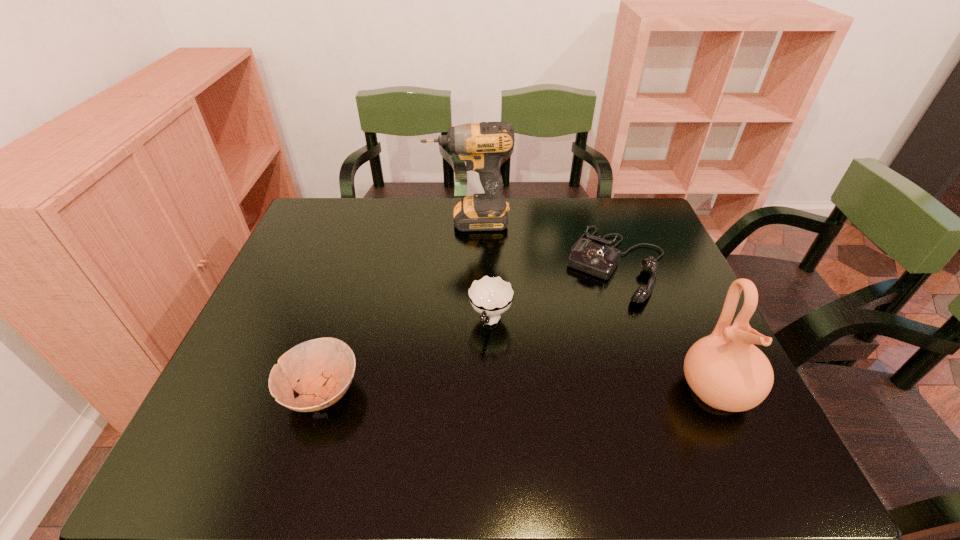
Image resolution: width=960 pixels, height=540 pixels. I want to click on vacant region located on the dial of the telephone, so point(551,395).

This screenshot has height=540, width=960. What are the coordinates of `free location located 0.400m on the dial of the telephone` in the screenshot? It's located at (538, 421).

Find the location of a particular element. The width and height of the screenshot is (960, 540). free space located 0.090m on the dial of the telephone is located at coordinates (590, 323).

Image resolution: width=960 pixels, height=540 pixels. Find the location of `vacant space located with the drill bit of the tallest object facing forward`. vacant space located with the drill bit of the tallest object facing forward is located at coordinates (471, 256).

Locate an element on the screen. This screenshot has height=540, width=960. vacant area situated with the drill bit of the tallest object facing forward is located at coordinates (474, 316).

This screenshot has width=960, height=540. Find the location of `vacant space located with the drill bit of the tallest object facing forward`. vacant space located with the drill bit of the tallest object facing forward is located at coordinates (472, 274).

The height and width of the screenshot is (540, 960). Find the location of `telephone that is at the far edge`. telephone that is at the far edge is located at coordinates (594, 257).

Where is `drill located in the far edge section of the desktop`? The width and height of the screenshot is (960, 540). drill located in the far edge section of the desktop is located at coordinates (481, 145).

This screenshot has width=960, height=540. Find the location of `bowl at the near edge`. bowl at the near edge is located at coordinates (325, 367).

The height and width of the screenshot is (540, 960). Find the location of `pottery that is positioned at the near edge`. pottery that is positioned at the near edge is located at coordinates (725, 370).